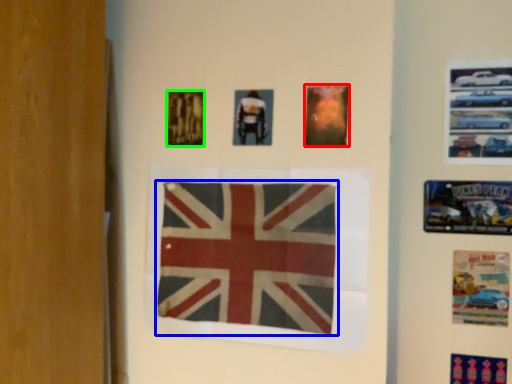
Question: Which object is the closest to the poster (highlighted by a red box)? Choose among these: flag (highlighted by a blue box) or poster (highlighted by a green box).

Choices:
 (A) flag
 (B) poster

Answer: (A)